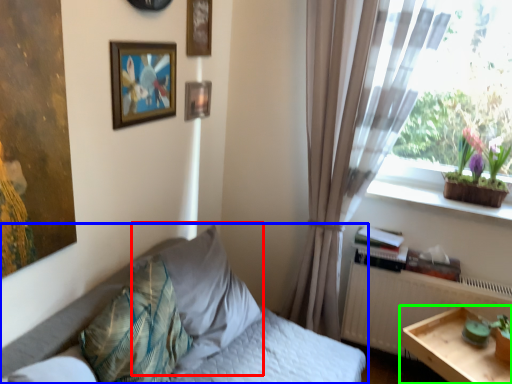
Question: Which object is positioned closest to pillow (highlighted by a red box)? Select from bed (highlighted by a blue box) and table (highlighted by a green box).

Choices:
 (A) bed
 (B) table

Answer: (A)